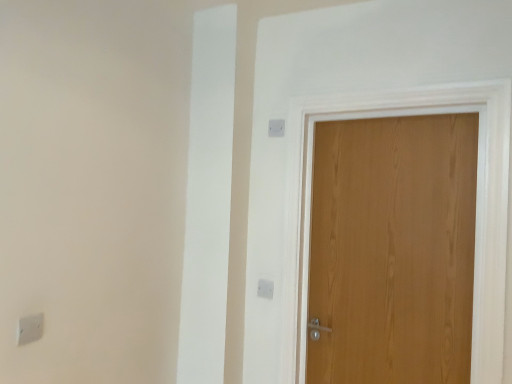
Question: Is the position of white plastic light switch at lower left, which is counted as the first light switch, starting from the left, more distant than that of white plastic light switch at upper center, positioned as the 1th light switch in bottom-to-top order?

Choices:
 (A) yes
 (B) no

Answer: (B)

Question: Is white plastic light switch at lower left, which is counted as the first light switch, starting from the left, positioned in front of white plastic light switch at upper center, which is the 2th light switch in left-to-right order?

Choices:
 (A) no
 (B) yes

Answer: (B)

Question: Is white plastic light switch at lower left, which is counted as the 3th light switch, starting from the back, to the right of white plastic light switch at upper center, the 3th light switch viewed from the front, from the viewer's perspective?

Choices:
 (A) no
 (B) yes

Answer: (A)

Question: Does white plastic light switch at lower left, the first light switch when ordered from front to back, have a greater width compared to white plastic light switch at upper center, the second light switch in the right-to-left sequence?

Choices:
 (A) yes
 (B) no

Answer: (B)

Question: Is white plastic light switch at lower left, the 3th light switch from the right, surrounding white plastic light switch at upper center, the 1th light switch from the back?

Choices:
 (A) yes
 (B) no

Answer: (B)

Question: Considering the relative positions of white plastic light switch at lower left, which is counted as the first light switch, starting from the left, and white plastic light switch at upper center, which is counted as the 1th light switch, starting from the right, in the image provided, is white plastic light switch at lower left, which is counted as the first light switch, starting from the left, to the left or to the right of white plastic light switch at upper center, which is counted as the 1th light switch, starting from the right,?

Choices:
 (A) left
 (B) right

Answer: (A)

Question: Is white plastic light switch at lower left, the first light switch when ordered from front to back, inside or outside of white plastic light switch at upper center, positioned as the second light switch in back-to-front order?

Choices:
 (A) outside
 (B) inside

Answer: (A)

Question: Is white plastic light switch at lower left, which is counted as the 3th light switch, starting from the back, bigger or smaller than white plastic light switch at upper center, which appears as the third light switch when ordered from the bottom?

Choices:
 (A) big
 (B) small

Answer: (A)

Question: Is white plastic light switch at lower left, which is counted as the 3th light switch, starting from the back, taller or shorter than white plastic light switch at upper center, which appears as the third light switch when ordered from the bottom?

Choices:
 (A) tall
 (B) short

Answer: (B)

Question: Would you say white plastic light switch at upper center, which is the 2th light switch in left-to-right order, is to the left or to the right of wooden door at right in the picture?

Choices:
 (A) left
 (B) right

Answer: (A)

Question: Is white plastic light switch at upper center, which is the 2th light switch in left-to-right order, wider or thinner than wooden door at right?

Choices:
 (A) thin
 (B) wide

Answer: (A)

Question: From the image's perspective, is white plastic light switch at upper center, which is the 2th light switch in left-to-right order, positioned above or below wooden door at right?

Choices:
 (A) below
 (B) above

Answer: (A)

Question: Is white plastic light switch at upper center, which is counted as the 3th light switch, starting from the top, bigger or smaller than wooden door at right?

Choices:
 (A) big
 (B) small

Answer: (B)

Question: Considering the positions of white plastic light switch at upper center, which appears as the third light switch when ordered from the bottom, and white plastic light switch at lower left, which is counted as the 3th light switch, starting from the back, in the image, is white plastic light switch at upper center, which appears as the third light switch when ordered from the bottom, wider or thinner than white plastic light switch at lower left, which is counted as the 3th light switch, starting from the back,?

Choices:
 (A) wide
 (B) thin

Answer: (B)

Question: Would you say white plastic light switch at upper center, the third light switch in the left-to-right sequence, is to the left or to the right of white plastic light switch at lower left, which is the 2th light switch from top to bottom, in the picture?

Choices:
 (A) right
 (B) left

Answer: (A)